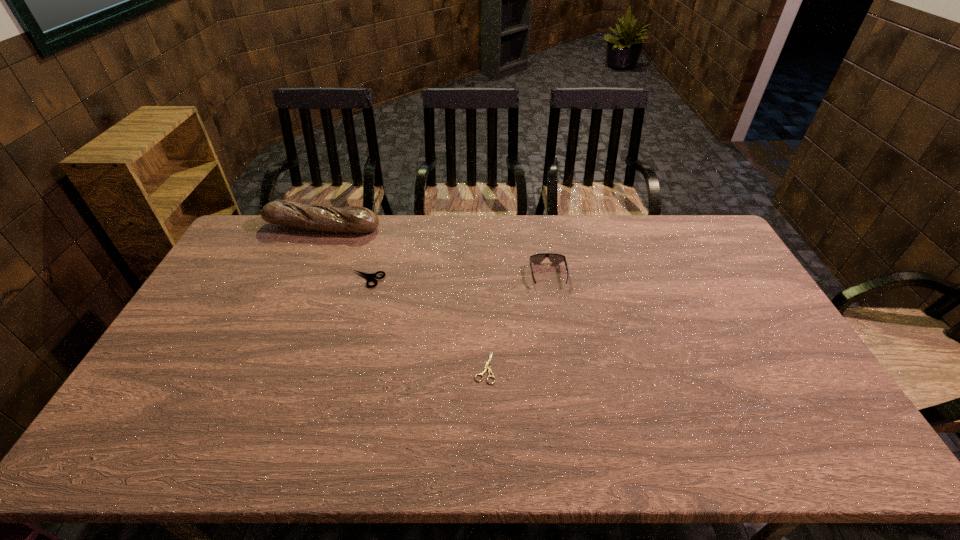
Locate an element on the screen. baguet is located at coordinates (353, 219).

The image size is (960, 540). Find the location of `the farthest object`. the farthest object is located at coordinates (353, 219).

Identify the location of sunglasses. This screenshot has width=960, height=540. (553, 257).

Locate an element on the screen. This screenshot has height=540, width=960. the rightmost object is located at coordinates (553, 257).

This screenshot has width=960, height=540. Find the location of `the second shortest object`. the second shortest object is located at coordinates (368, 276).

The width and height of the screenshot is (960, 540). Find the location of `the taller shears`. the taller shears is located at coordinates (368, 276).

At what (x,y) coordinates should I click in order to perform the action: click on the nearest object. Please return your answer as a coordinate pair (x, y). Looking at the image, I should click on (487, 367).

Where is `the right shears`? the right shears is located at coordinates (487, 367).

At what (x,y) coordinates should I click in order to perform the action: click on blank area located on the right of the baguet. Please return your answer as a coordinate pair (x, y). Image resolution: width=960 pixels, height=540 pixels. Looking at the image, I should click on point(438,226).

You are a GUI agent. You are given a task and a screenshot of the screen. Output one action in this format:
    pyautogui.click(x=<x>, y=<y>)
    Task: Click on the free space located 0.100m on the front-facing side of the rightmost object
    This screenshot has width=960, height=540.
    Given the screenshot: What is the action you would take?
    pyautogui.click(x=554, y=311)